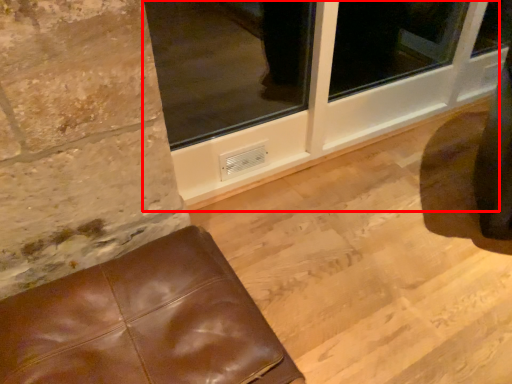
Question: Where is window frame (annotated by the red box) located in relation to furniture in the image?

Choices:
 (A) right
 (B) left

Answer: (A)